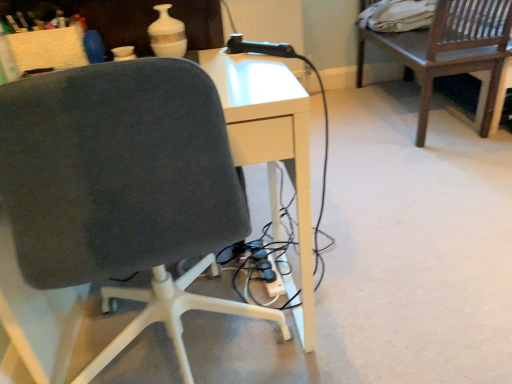
Where is `vacant area that is situated to the right of dark gray fabric chair at center`? The image size is (512, 384). vacant area that is situated to the right of dark gray fabric chair at center is located at coordinates (375, 285).